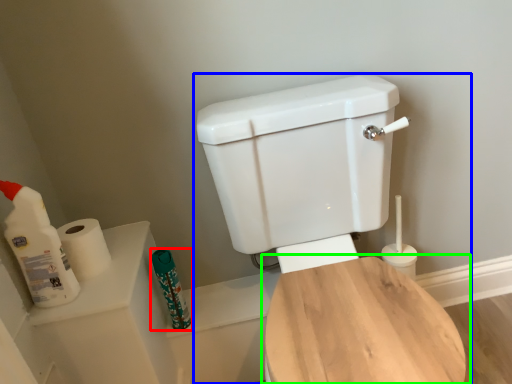
Question: Estimate the real-world distances between objects in this image. Which object is closer to toiletry (highlighted by a red box), toilet (highlighted by a blue box) or toilet (highlighted by a green box)?

Choices:
 (A) toilet
 (B) toilet

Answer: (A)